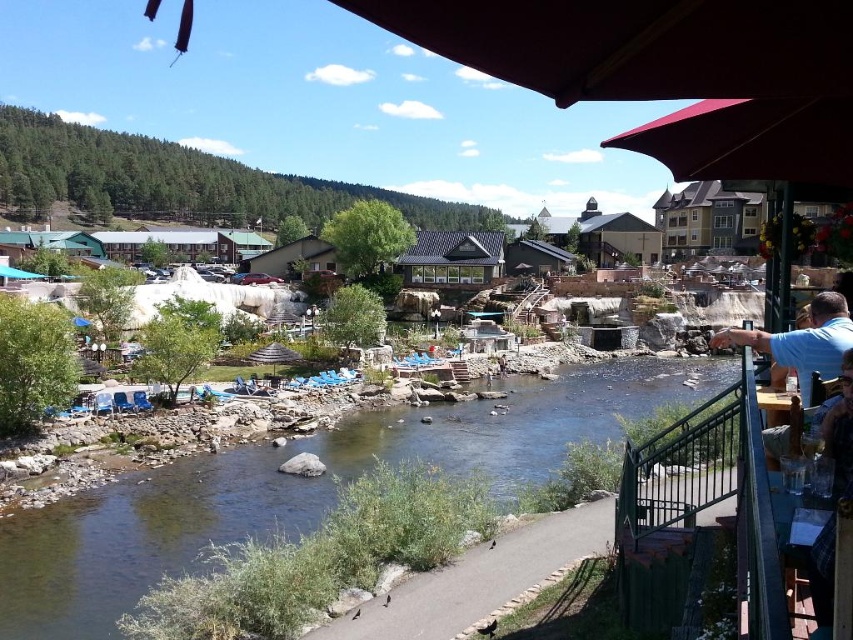
You are standing at the point marked by the coordinates point (305, 486) in the image. What can you observe around you based on the scene description?

The point (305, 486) indicates clear water stream at center, so you are standing at the clear water stream at center in the scenic riverside setting.

You are standing on the riverside pathway and see the clear water stream at center and the blue shirt at right. Which object is located to the left of the other?

The clear water stream at center is positioned on the left side of blue shirt at right.